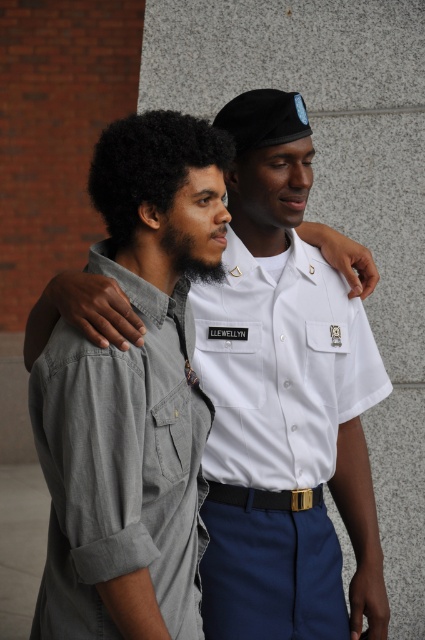
You are an observer standing in front of the image. There is a point at coordinates (280, 365). Based on the scene description, what object is located at that point?

The point at coordinates (280, 365) indicates the white smooth shirt at center.

You are a photographer trying to capture a clear photo of the white smooth shirt at center and the dark curly hair at center. Which object should you focus on first to ensure it appears sharp in the photo?

The white smooth shirt at center is much taller than the dark curly hair at center, so you should focus on the white smooth shirt at center first to ensure it appears sharp in the photo.